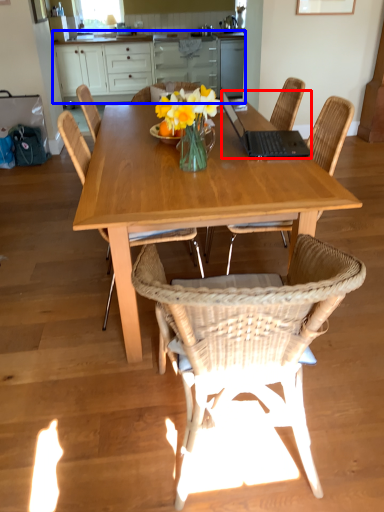
Question: Which of the following is the closest to the observer, laptop (highlighted by a red box) or cabinetry (highlighted by a blue box)?

Choices:
 (A) laptop
 (B) cabinetry

Answer: (A)